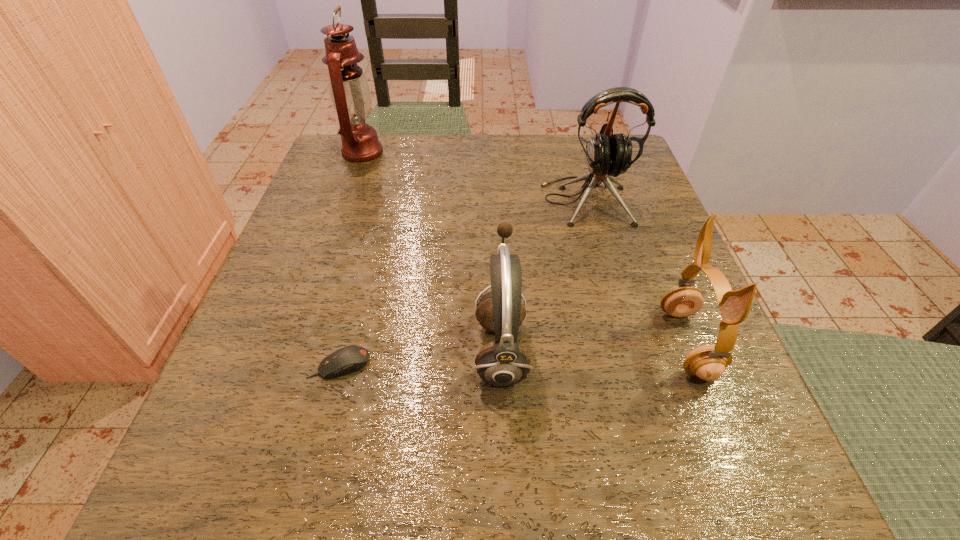
This screenshot has width=960, height=540. I want to click on free space at the left edge, so tap(233, 393).

In the image, there is a desktop. Where is `blank space at the right edge`? Image resolution: width=960 pixels, height=540 pixels. blank space at the right edge is located at coordinates (640, 217).

Find the location of a particular element. The image size is (960, 540). vacant space at the near left corner of the desktop is located at coordinates (282, 515).

Where is `free space between the oil lamp and the third object from left to right`? The height and width of the screenshot is (540, 960). free space between the oil lamp and the third object from left to right is located at coordinates (432, 251).

The image size is (960, 540). Find the location of `free spot between the computer mouse and the second tallest object`. free spot between the computer mouse and the second tallest object is located at coordinates (463, 282).

At what (x,y) coordinates should I click in order to perform the action: click on free area in between the tallest object and the fourth nearest object. Please return your answer as a coordinate pair (x, y). The height and width of the screenshot is (540, 960). Looking at the image, I should click on (474, 176).

The width and height of the screenshot is (960, 540). In order to click on empty location between the leftmost earphone and the oil lamp in this screenshot , I will do 432,251.

The image size is (960, 540). In order to click on blank region between the farthest object and the leftmost earphone in this screenshot , I will do `click(432, 251)`.

Identify the location of the fourth closest object to the farthest object. The height and width of the screenshot is (540, 960). (708, 362).

Select which object is the closest to the leftmost earphone. Please provide its 2D coordinates. Your answer should be formatted as a tuple, i.e. [(x, y)], where the tuple contains the x and y coordinates of a point satisfying the conditions above.

[(348, 359)]